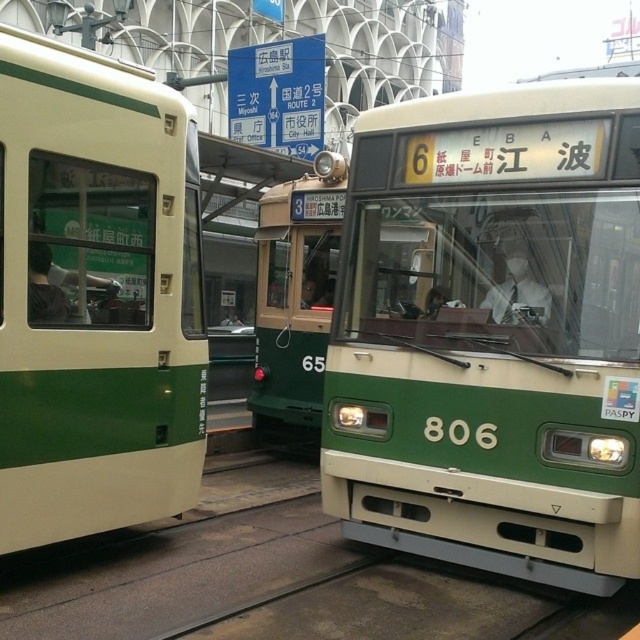
Is green matte train at left positioned at the back of green matte train at center?

No, green matte train at left is in front of green matte train at center.

At what (x,y) coordinates should I click in order to perform the action: click on green matte train at left. Please return your answer as a coordinate pair (x, y). Looking at the image, I should click on (96, 296).

Is green matte tram at center smaller than green matte train at left?

No.

Can you confirm if green matte tram at center is taller than green matte train at left?

In fact, green matte tram at center may be shorter than green matte train at left.

What do you see at coordinates (492, 333) in the screenshot?
I see `green matte tram at center` at bounding box center [492, 333].

Locate an element on the screen. green matte tram at center is located at coordinates (492, 333).

Is green matte tram at center above green matte train at center?

No, green matte tram at center is not above green matte train at center.

Does green matte tram at center have a greater width compared to green matte train at center?

Yes.

Describe the element at coordinates (492, 333) in the screenshot. I see `green matte tram at center` at that location.

Where is `green matte tram at center`? green matte tram at center is located at coordinates (492, 333).